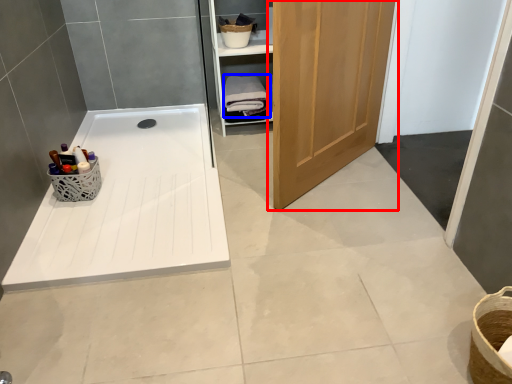
Question: Which object appears farthest to the camera in this image, door (highlighted by a red box) or bath towel (highlighted by a blue box)?

Choices:
 (A) door
 (B) bath towel

Answer: (B)